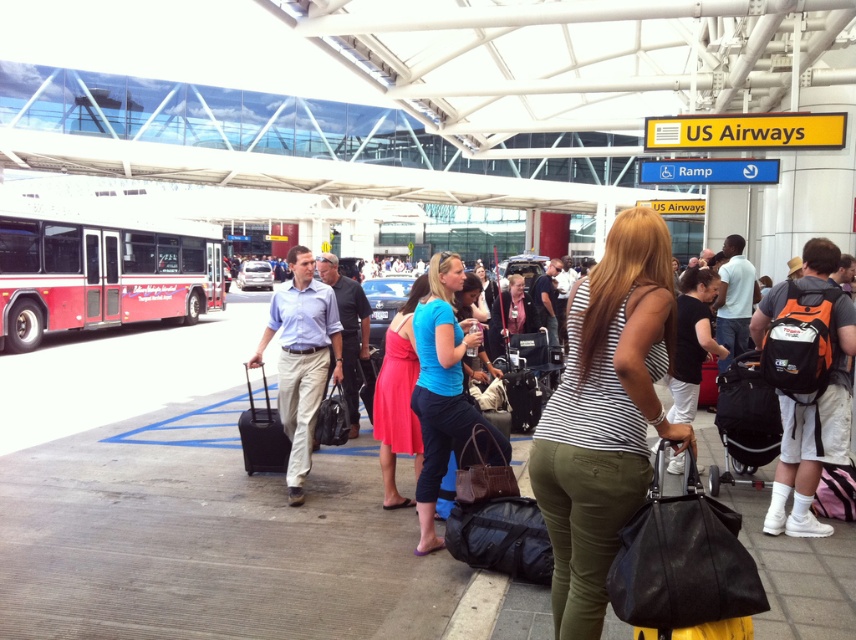
Consider the image. You are a fashion designer observing the airport scene. You notice a person wearing a striped fabric tank top at center and light beige cotton pants at center. Which clothing item has a greater width?

The striped fabric tank top at center has a greater width than the light beige cotton pants at center.

Based on the photo, you are navigating through the airport terminal and notice two points marked on the floor. The first point is at coordinate point (611, 404) and the second is at point (311, 422). Which point is closer to your current position if you are standing at the entrance of the terminal?

Point (611, 404) is in front of point (311, 422), so it is closer to your current position at the entrance.

You are a traveler at the airport terminal. You are wearing the light beige cotton pants at center and the light blue shirt at center. If you want to store your clothes in a luggage bag, which item would you place first based on their size?

The light beige cotton pants at center occupies less space than light blue shirt at center, so you should place the light beige cotton pants at center first to maximize space efficiency.